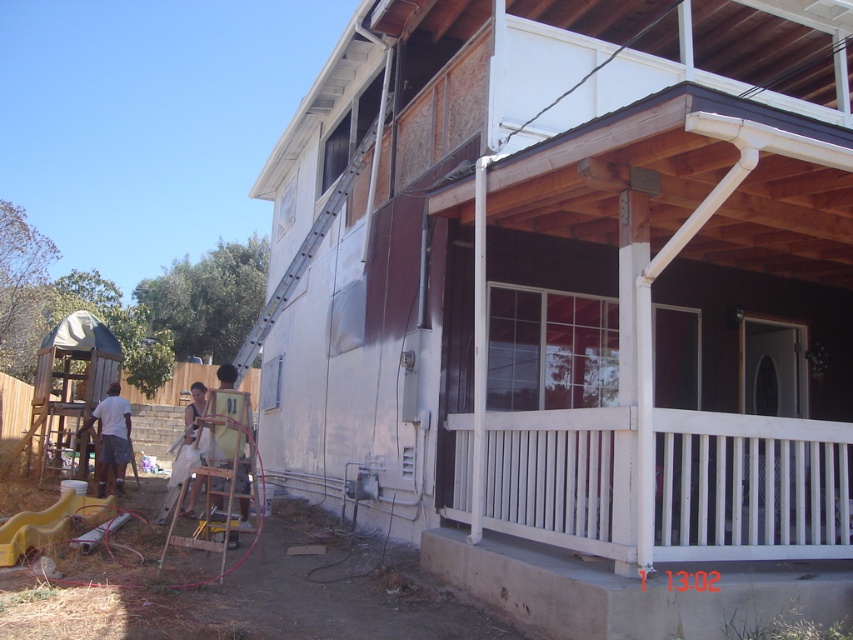
Is white wooden porch at center bigger than yellow fabric shirt at center?

Incorrect, white wooden porch at center is not larger than yellow fabric shirt at center.

Does white wooden porch at center appear on the left side of yellow fabric shirt at center?

In fact, white wooden porch at center is to the right of yellow fabric shirt at center.

You are a GUI agent. You are given a task and a screenshot of the screen. Output one action in this format:
    pyautogui.click(x=<x>, y=<y>)
    Task: Click on the white wooden porch at center
    This screenshot has height=640, width=853.
    Given the screenshot: What is the action you would take?
    pyautogui.click(x=750, y=486)

Does white cotton shirt at left appear over yellow fabric shirt at center?

No, white cotton shirt at left is not above yellow fabric shirt at center.

Is white cotton shirt at left to the left of yellow fabric shirt at center from the viewer's perspective?

No, white cotton shirt at left is not to the left of yellow fabric shirt at center.

Between point (119, 467) and point (230, 372), which one is positioned in front?

Point (230, 372) is more forward.

Locate an element on the screen. Image resolution: width=853 pixels, height=640 pixels. white cotton shirt at left is located at coordinates (111, 436).

Is white wooden porch at center shorter than white cotton shirt at left?

Correct, white wooden porch at center is not as tall as white cotton shirt at left.

Is white wooden porch at center positioned in front of white cotton shirt at left?

That is True.

In order to click on white wooden porch at center in this screenshot , I will do `click(750, 486)`.